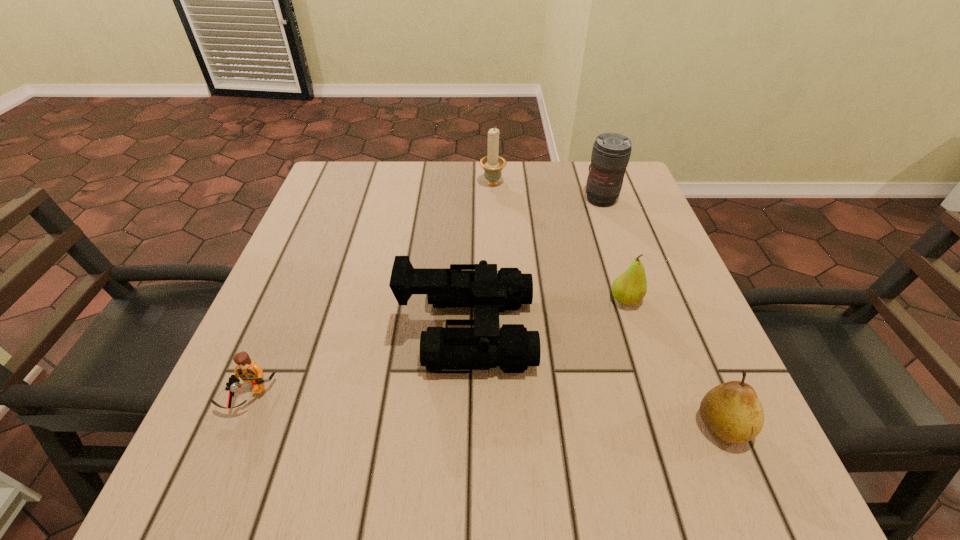
Find the location of a particular element. This screenshot has width=960, height=540. vacant space at the near edge is located at coordinates (542, 453).

The height and width of the screenshot is (540, 960). In order to click on free spot at the left edge of the desktop in this screenshot , I will do [279, 382].

This screenshot has width=960, height=540. What are the coordinates of `vacant area at the right edge of the desktop` in the screenshot? It's located at (659, 294).

The image size is (960, 540). In the image, there is a desktop. What are the coordinates of `vacant space at the far left corner` in the screenshot? It's located at (360, 209).

Locate an element on the screen. vacant space at the far right corner of the desktop is located at coordinates (628, 201).

You are a GUI agent. You are given a task and a screenshot of the screen. Output one action in this format:
    pyautogui.click(x=<x>, y=<y>)
    Task: Click on the vacant region at the near right corner
    Image resolution: width=960 pixels, height=540 pixels.
    Given the screenshot: What is the action you would take?
    pyautogui.click(x=680, y=448)

In order to click on vacant area between the candle_holder and the farther pear in this screenshot , I will do `click(560, 241)`.

At what (x,y) coordinates should I click in order to perform the action: click on empty location between the nearer pear and the binoculars. Please return your answer as a coordinate pair (x, y). The width and height of the screenshot is (960, 540). Looking at the image, I should click on (595, 377).

This screenshot has height=540, width=960. Identify the location of vacant space that's between the candle_holder and the binoculars. (480, 256).

Identify the location of free space between the telephoto lens and the candle_holder. This screenshot has height=540, width=960. (547, 191).